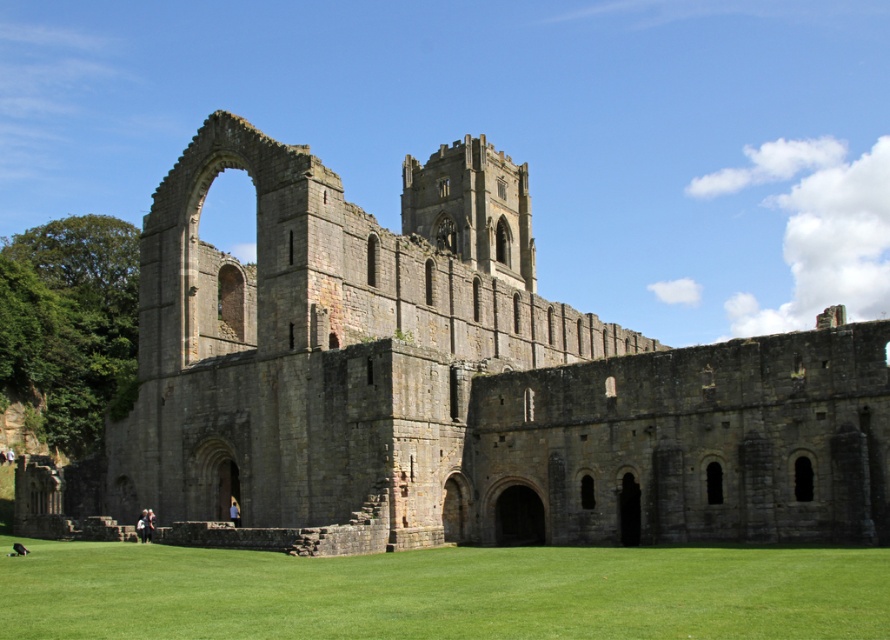
Is gray stone monastery at center positioned at the back of green grass at lower center?

Yes, it is.

Does gray stone monastery at center appear under green grass at lower center?

No, gray stone monastery at center is not below green grass at lower center.

Is point (638, 349) closer to camera compared to point (688, 572)?

No, it is not.

Identify the location of gray stone monastery at center. The height and width of the screenshot is (640, 890). point(448,387).